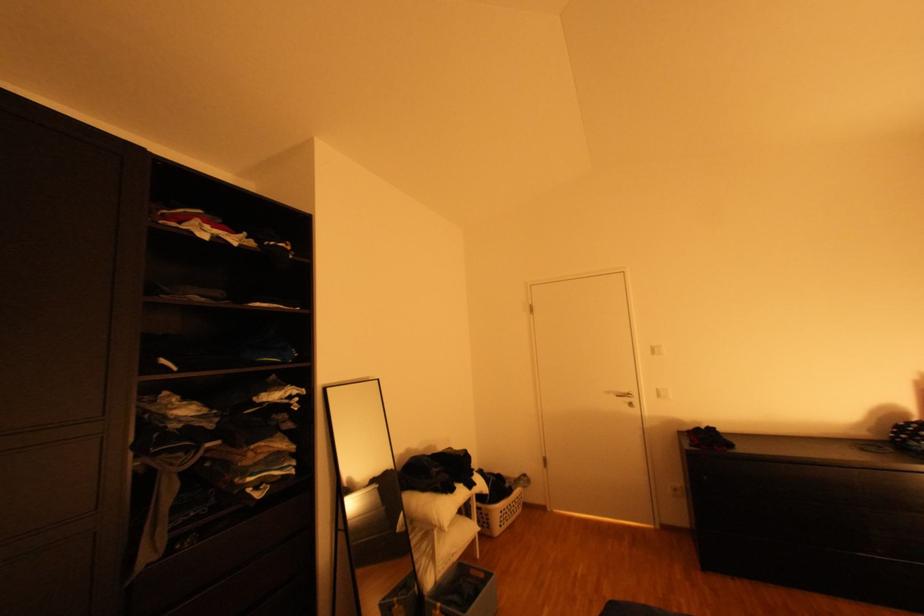
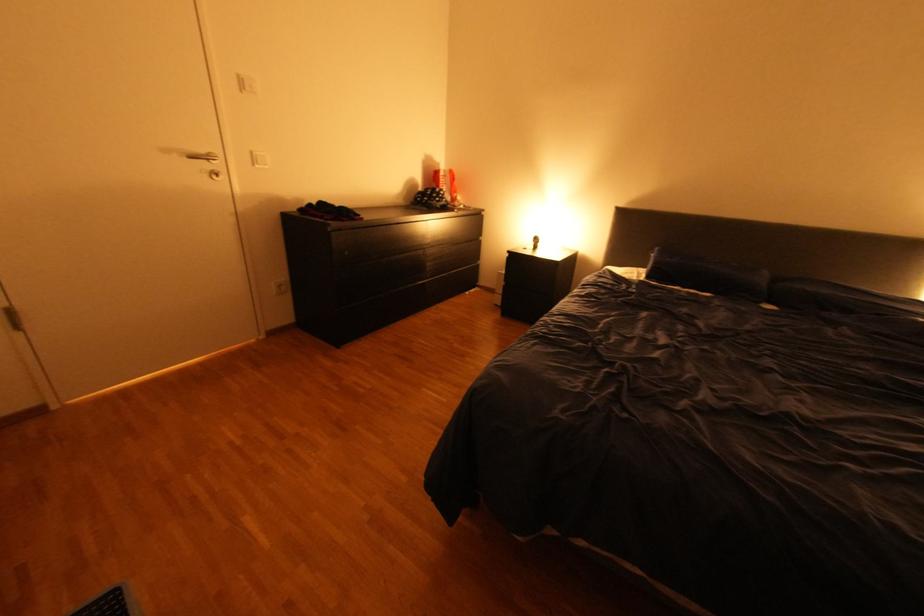
The point at (636, 391) is marked in the first image. Where is the corresponding point in the second image?

(213, 151)